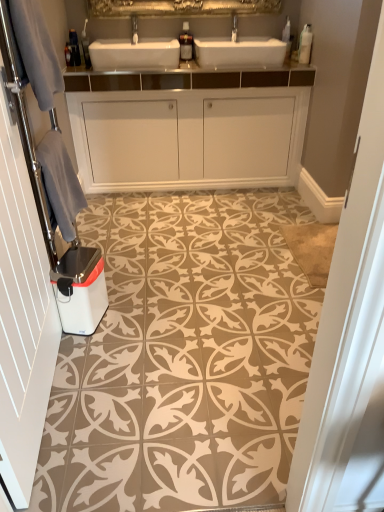
Where is `vacant area to the right of white textured towel at left`? This screenshot has height=512, width=384. vacant area to the right of white textured towel at left is located at coordinates (139, 400).